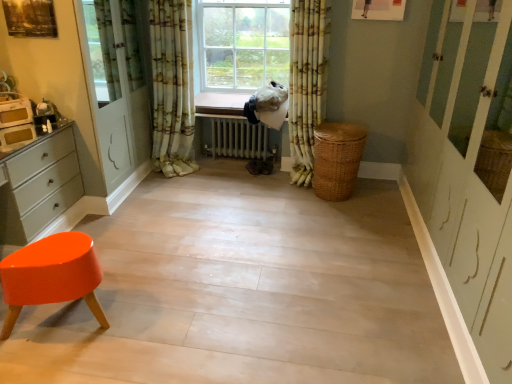
Question: Is point click(343, 193) positioned closer to the camera than point click(226, 150)?

Choices:
 (A) farther
 (B) closer

Answer: (B)

Question: From a real-world perspective, is woven brown basket at lower right above or below white metallic radiator at center?

Choices:
 (A) below
 (B) above

Answer: (B)

Question: Which object is the closest to the white metallic radiator at center?

Choices:
 (A) woven brown basket at lower right
 (B) glossy plastic stool at lower left
 (C) floral fabric curtain at center, arranged as the 1th curtain when viewed from the left
 (D) matte white toaster at left
 (E) matte white chest of drawers at left

Answer: (C)

Question: Estimate the real-world distances between objects in this image. Which object is farther from the woven brown basket at lower right?

Choices:
 (A) matte white chest of drawers at left
 (B) floral fabric curtain at center, arranged as the 1th curtain when viewed from the left
 (C) floral fabric curtain at center, which is the second curtain in left-to-right order
 (D) matte white toaster at left
 (E) white metallic radiator at center

Answer: (D)